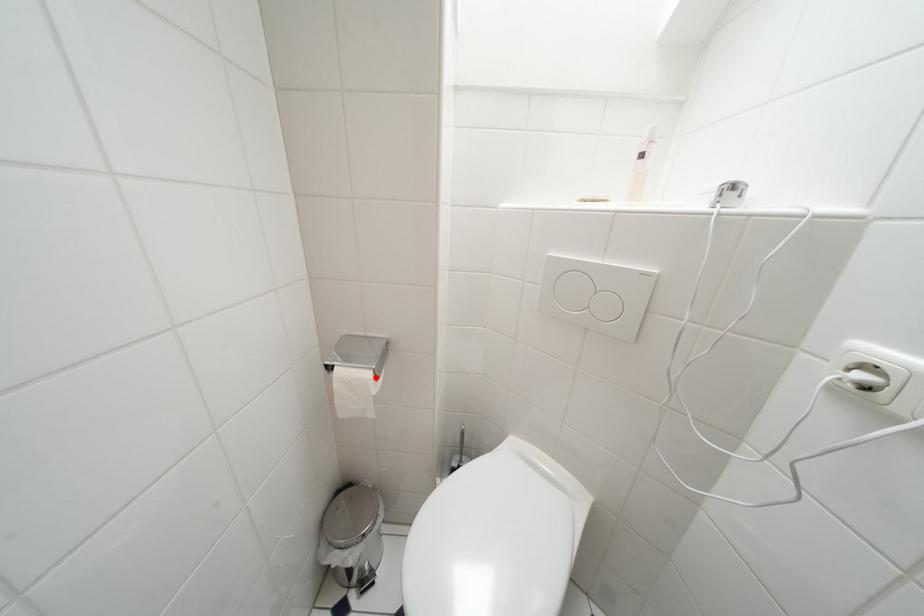
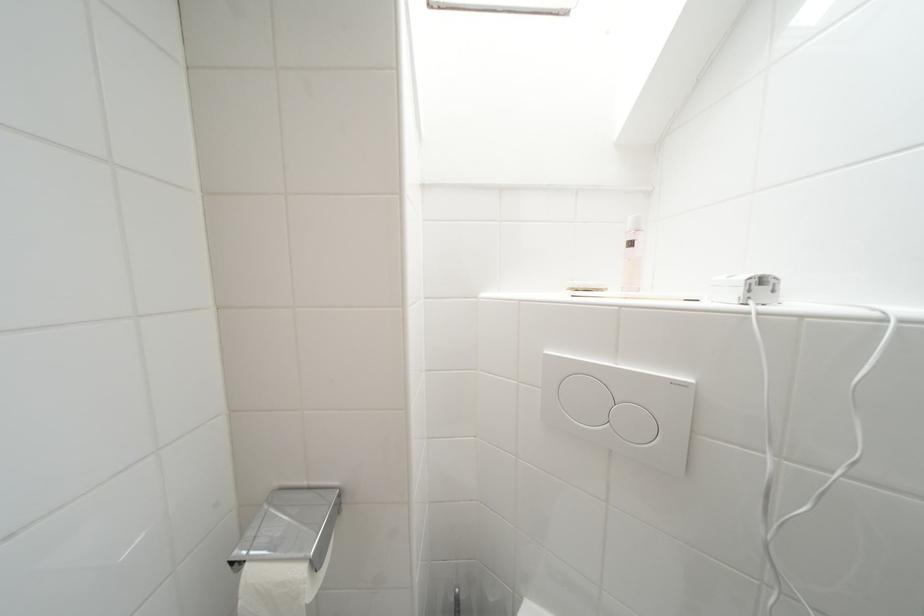
The point at the highlighted location is marked in the first image. Where is the corresponding point in the second image?

(309, 575)